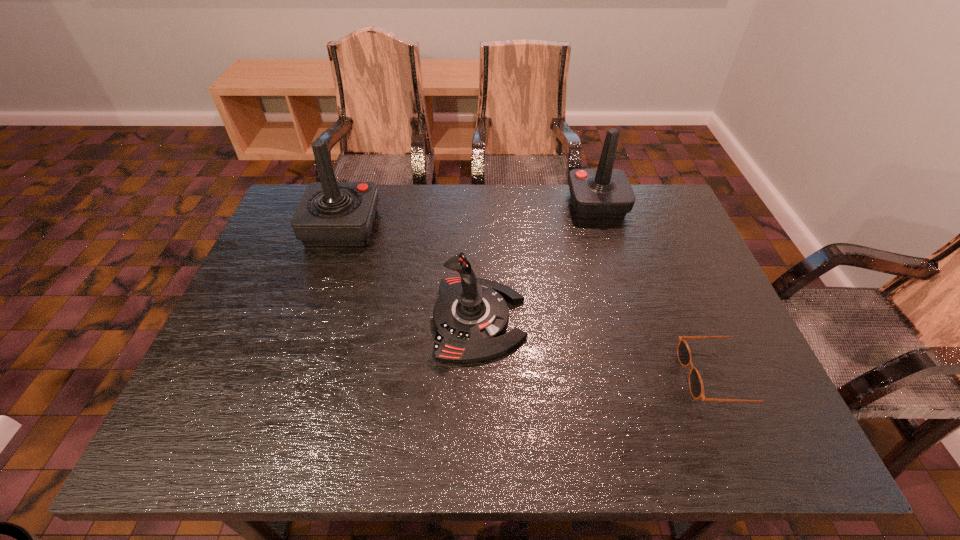
Identify the location of the leftmost object. The width and height of the screenshot is (960, 540). (330, 213).

The image size is (960, 540). In order to click on the rightmost joystick in this screenshot , I will do `click(604, 192)`.

Find the location of a particular element. This screenshot has height=540, width=960. the second object from left to right is located at coordinates (471, 315).

Identify the location of the shortest joystick. (471, 315).

Identify the location of the shortest object. Image resolution: width=960 pixels, height=540 pixels. (696, 387).

Where is `free space located on the front-facing side of the leftmost joystick`? This screenshot has height=540, width=960. free space located on the front-facing side of the leftmost joystick is located at coordinates (399, 226).

Locate an element on the screen. vacant area located 0.220m on the front of the rightmost joystick is located at coordinates (618, 274).

This screenshot has width=960, height=540. Identify the location of free spot located on the handle side of the shortest joystick. (674, 319).

Where is `vacant position located 0.130m on the front-facing side of the sunglasses`? vacant position located 0.130m on the front-facing side of the sunglasses is located at coordinates (624, 376).

You are a GUI agent. You are given a task and a screenshot of the screen. Output one action in this format:
    pyautogui.click(x=<x>, y=<y>)
    Task: Click on the free region located 0.400m on the front-facing side of the sunglasses
    The width and height of the screenshot is (960, 540).
    Given the screenshot: What is the action you would take?
    pyautogui.click(x=500, y=376)